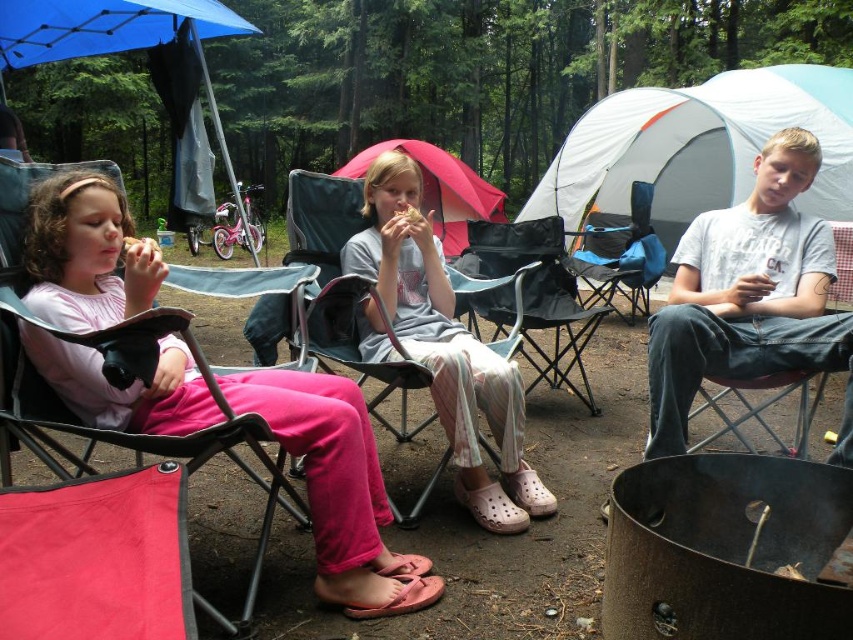
Question: Can you confirm if pink fabric chair at center is thinner than black mesh chair at center?

Choices:
 (A) yes
 (B) no

Answer: (A)

Question: Is blue fabric chair at center thinner than matte pink tent at center?

Choices:
 (A) yes
 (B) no

Answer: (A)

Question: Among these objects, which one is nearest to the camera?

Choices:
 (A) white/orange fabric tent at right
 (B) blue fabric chair at center

Answer: (B)

Question: Is matte black folding chair at left further to the viewer compared to pink fabric chair at center?

Choices:
 (A) yes
 (B) no

Answer: (B)

Question: Which point appears closest to the camera in this image?

Choices:
 (A) (631, 108)
 (B) (280, 454)
 (C) (347, 211)

Answer: (B)

Question: Which of the following is the closest to the observer?

Choices:
 (A) (148, 317)
 (B) (500, 202)
 (C) (329, 260)

Answer: (A)